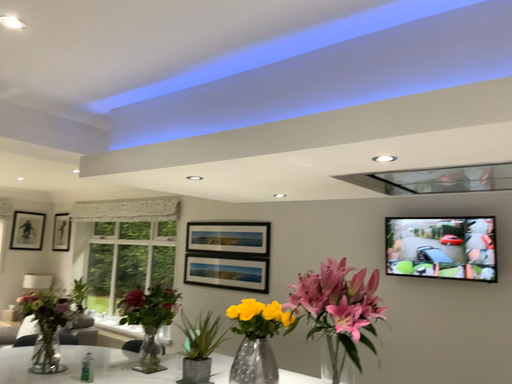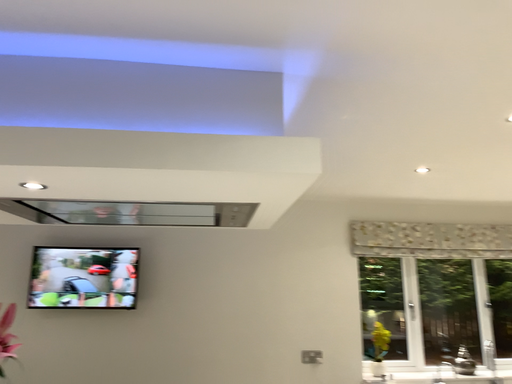
Question: How did the camera likely rotate when shooting the video?

Choices:
 (A) rotated left
 (B) rotated right

Answer: (B)